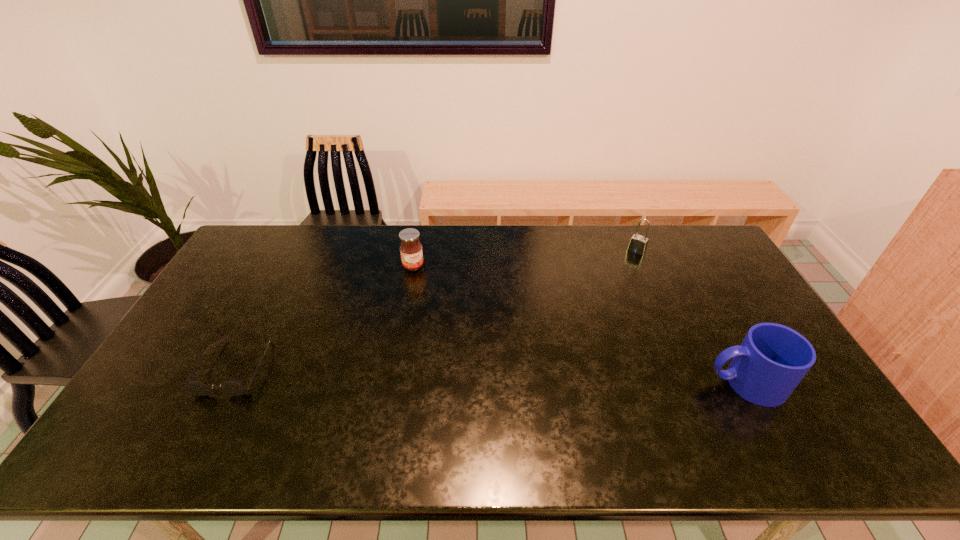
You are a GUI agent. You are given a task and a screenshot of the screen. Output one action in this format:
    pyautogui.click(x=<x>, y=<y>)
    Task: Click on the free space on the desktop that is between the shortest object and the mug and is positioned on the label side of the second farthest object
    This screenshot has width=960, height=540.
    Given the screenshot: What is the action you would take?
    pyautogui.click(x=484, y=375)

Find the location of a particular element. vacant space on the desktop that is between the leftmost object and the mug and is positioned on the shackle of the farthest object is located at coordinates (548, 377).